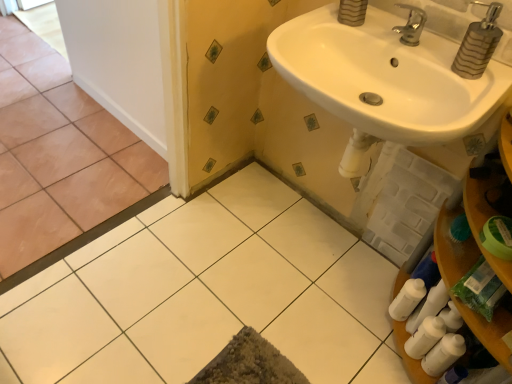
At what (x,y) coordinates should I click in order to perform the action: click on free region under white glossy sink at upper right (from a real-world perspective). Please return your answer as a coordinate pair (x, y). Looking at the image, I should click on (317, 255).